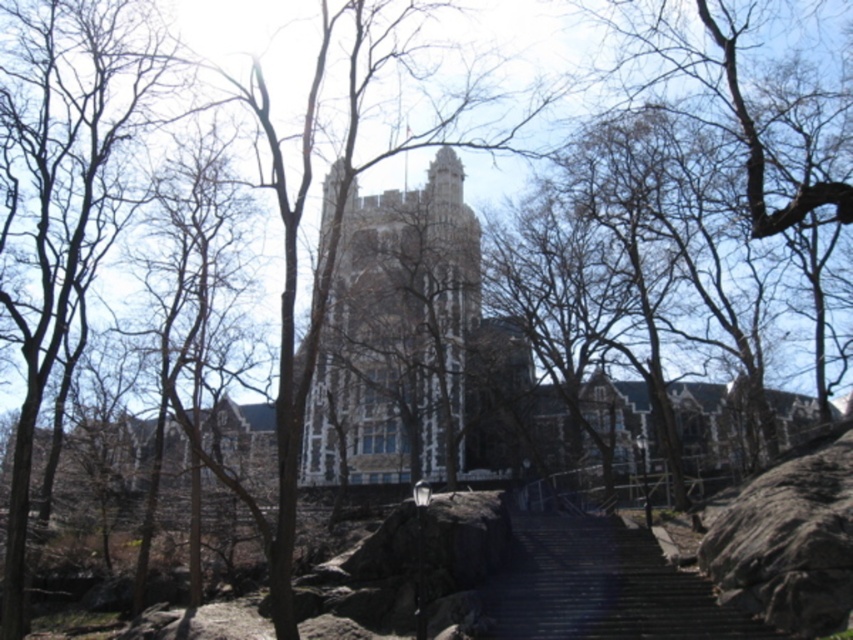
Question: Does stone tower at center appear on the right side of dark gray rough rock at lower right?

Choices:
 (A) yes
 (B) no

Answer: (B)

Question: Which point is closer to the camera?

Choices:
 (A) stone tower at center
 (B) dark gray concrete stairs at center
 (C) dark gray rough rock at lower right

Answer: (C)

Question: Is dark gray concrete stairs at center to the left of dark gray rough rock at lower right from the viewer's perspective?

Choices:
 (A) no
 (B) yes

Answer: (B)

Question: Which of the following is the closest to the observer?

Choices:
 (A) (733, 616)
 (B) (379, 456)
 (C) (820, 541)

Answer: (C)

Question: Which point is farther from the camera taking this photo?

Choices:
 (A) (793, 538)
 (B) (590, 541)
 (C) (370, 314)

Answer: (C)

Question: Can you confirm if dark gray concrete stairs at center is positioned below dark gray rough rock at lower right?

Choices:
 (A) no
 (B) yes

Answer: (B)